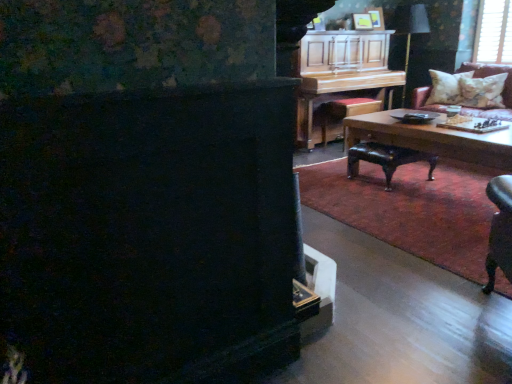
I want to click on black fabric lampshade at upper right, so click(409, 30).

Measure the distance between point (502, 83) and camera.

They are 5.14 meters apart.

The height and width of the screenshot is (384, 512). I want to click on wooden stool at center, the first stool in the top-to-bottom sequence, so click(x=346, y=111).

What is the approximate width of leather couch with floral pillows at upper right?

leather couch with floral pillows at upper right is 32.00 inches in width.

I want to click on leather couch with floral pillows at upper right, so tap(495, 109).

This screenshot has width=512, height=384. What do you see at coordinates (362, 21) in the screenshot?
I see `matte yellow picture frame at upper center` at bounding box center [362, 21].

What are the coordinates of `black fabric lampshade at upper right` in the screenshot? It's located at (409, 30).

Is wooden piano at upper right positioned beyond the bounds of leather couch with floral pillows at upper right?

Yes.

What's the angular difference between wooden piano at upper right and leather couch with floral pillows at upper right's facing directions?

wooden piano at upper right and leather couch with floral pillows at upper right are facing 89.7 degrees away from each other.

Considering the relative sizes of wooden piano at upper right and leather couch with floral pillows at upper right in the image provided, is wooden piano at upper right taller than leather couch with floral pillows at upper right?

Yes, wooden piano at upper right is taller than leather couch with floral pillows at upper right.

Is wooden piano at upper right with leather couch with floral pillows at upper right?

No, wooden piano at upper right is not with leather couch with floral pillows at upper right.

How many degrees apart are the facing directions of matte yellow picture frame at upper center and white mesh screen at upper right?

81.4 degrees separate the facing orientations of matte yellow picture frame at upper center and white mesh screen at upper right.

From the image's perspective, which one is positioned higher, matte yellow picture frame at upper center or white mesh screen at upper right?

From the image's view, matte yellow picture frame at upper center is above.

Considering the sizes of objects matte yellow picture frame at upper center and white mesh screen at upper right in the image provided, who is smaller, matte yellow picture frame at upper center or white mesh screen at upper right?

With smaller size is matte yellow picture frame at upper center.

Where is `picture frame that is above the white mesh screen at upper right (from the image's perspective)`? This screenshot has height=384, width=512. picture frame that is above the white mesh screen at upper right (from the image's perspective) is located at coordinates (362, 21).

From a real-world perspective, is wooden stool at center, marked as the 2th stool in a bottom-to-top arrangement, positioned above or below leather couch with floral pillows at upper right?

In terms of real-world spatial position, wooden stool at center, marked as the 2th stool in a bottom-to-top arrangement, is below leather couch with floral pillows at upper right.

Where is `stool that appears behind the leather couch with floral pillows at upper right`? The width and height of the screenshot is (512, 384). stool that appears behind the leather couch with floral pillows at upper right is located at coordinates (346, 111).

Considering the sizes of wooden stool at center, the 2th stool viewed from the front, and leather couch with floral pillows at upper right in the image, is wooden stool at center, the 2th stool viewed from the front, taller or shorter than leather couch with floral pillows at upper right?

Considering their sizes, wooden stool at center, the 2th stool viewed from the front, has less height than leather couch with floral pillows at upper right.

Can we say wooden stool at center, the first stool in the top-to-bottom sequence, lies outside leather couch with floral pillows at upper right?

wooden stool at center, the first stool in the top-to-bottom sequence, is positioned outside leather couch with floral pillows at upper right.

From a real-world perspective, between leather couch with floral pillows at upper right and black fabric lampshade at upper right, who is vertically higher?

From a 3D spatial view, black fabric lampshade at upper right is above.

Is leather couch with floral pillows at upper right not close to black fabric lampshade at upper right?

leather couch with floral pillows at upper right is near black fabric lampshade at upper right, not far away.

Is black fabric lampshade at upper right located within leather couch with floral pillows at upper right?

No, black fabric lampshade at upper right is located outside of leather couch with floral pillows at upper right.

From a real-world perspective, which object stands above the other?

In real-world perspective, matte yellow picture frame at upper center is above.

Is point (508, 71) less distant than point (367, 13)?

No, it is not.

From the image's perspective, which one is positioned higher, leather couch with floral pillows at upper right or matte yellow picture frame at upper center?

matte yellow picture frame at upper center appears higher in the image.

Who is shorter, leather couch with floral pillows at upper right or matte yellow picture frame at upper center?

matte yellow picture frame at upper center is shorter.

In the image, there is a fluffy beige pillow at upper right, the 2th pillow when ordered from front to back. Where is `coffee table below it (from a real-world perspective)`? This screenshot has width=512, height=384. coffee table below it (from a real-world perspective) is located at coordinates 432,138.

Between fluffy beige pillow at upper right, positioned as the 1th pillow in back-to-front order, and wooden polished coffee table at center, which one appears on the left side from the viewer's perspective?

From the viewer's perspective, wooden polished coffee table at center appears more on the left side.

Considering the points (443, 101) and (497, 168), which point is in front, point (443, 101) or point (497, 168)?

Point (497, 168)

Could you tell me if fluffy beige pillow at upper right, the 2th pillow when ordered from front to back, is turned towards wooden polished coffee table at center?

Yes, fluffy beige pillow at upper right, the 2th pillow when ordered from front to back, is turned towards wooden polished coffee table at center.

In the image, is wooden piano at upper right positioned in front of or behind white textured pillow at upper right, arranged as the second pillow when viewed from the back?

In the image, wooden piano at upper right appears in front of white textured pillow at upper right, arranged as the second pillow when viewed from the back.

Based on the photo, how different are the orientations of wooden piano at upper right and white textured pillow at upper right, which is counted as the 1th pillow, starting from the front, in degrees?

They differ by 66 degrees in their facing directions.

Which is closer, (x=345, y=48) or (x=498, y=90)?

Point (x=345, y=48) is positioned closer to the camera compared to point (x=498, y=90).

From a real-world perspective, between wooden piano at upper right and white textured pillow at upper right, which is counted as the 1th pillow, starting from the front, who is vertically higher?

wooden piano at upper right.

You are a GUI agent. You are given a task and a screenshot of the screen. Output one action in this format:
    pyautogui.click(x=<x>, y=<y>)
    Task: Click on the piano on the left of leather couch with floral pillows at upper right
    
    Given the screenshot: What is the action you would take?
    pyautogui.click(x=341, y=72)

This screenshot has width=512, height=384. Find the location of `picture frame above the white mesh screen at upper right (from a real-world perspective)`. picture frame above the white mesh screen at upper right (from a real-world perspective) is located at coordinates (362, 21).

Based on their spatial positions, is wooden piano at upper right or white textured pillow at upper right, arranged as the second pillow when viewed from the back, further from wooden stool at center, marked as the 2th stool in a bottom-to-top arrangement?

Among the two, white textured pillow at upper right, arranged as the second pillow when viewed from the back, is located further to wooden stool at center, marked as the 2th stool in a bottom-to-top arrangement.

Looking at this image, from the image, which object appears to be nearer to fluffy beige pillow at upper right, the 2th pillow when ordered from front to back, white textured pillow at upper right, which is counted as the 1th pillow, starting from the front, or black fabric lampshade at upper right?

Among the two, white textured pillow at upper right, which is counted as the 1th pillow, starting from the front, is located nearer to fluffy beige pillow at upper right, the 2th pillow when ordered from front to back.

Consider the image. When comparing their distances from black fabric lampshade at upper right, does matte yellow picture frame at upper center or wooden piano at upper right seem further?

wooden piano at upper right.

Consider the image. Looking at the image, which one is located closer to black fabric lampshade at upper right, white textured pillow at upper right, which is counted as the 1th pillow, starting from the front, or leather stool at center, which is the 1th stool from front to back?

white textured pillow at upper right, which is counted as the 1th pillow, starting from the front, is positioned closer to the anchor black fabric lampshade at upper right.

From the image, which object appears to be farther from leather couch with floral pillows at upper right, wooden stool at center, placed as the 1th stool when sorted from back to front, or wooden piano at upper right?

Based on the image, wooden stool at center, placed as the 1th stool when sorted from back to front, appears to be further to leather couch with floral pillows at upper right.

Considering their positions, is white mesh screen at upper right positioned closer to white textured pillow at upper right, which is counted as the 1th pillow, starting from the front, than fluffy beige pillow at upper right, positioned as the 1th pillow in back-to-front order?

The object closer to white textured pillow at upper right, which is counted as the 1th pillow, starting from the front, is fluffy beige pillow at upper right, positioned as the 1th pillow in back-to-front order.

From the image, which object appears to be farther from leather couch with floral pillows at upper right, wooden piano at upper right or wooden stool at center, marked as the 2th stool in a bottom-to-top arrangement?

wooden stool at center, marked as the 2th stool in a bottom-to-top arrangement, is positioned further to the anchor leather couch with floral pillows at upper right.

Considering their positions, is matte yellow picture frame at upper center positioned further to white textured pillow at upper right, which is counted as the 1th pillow, starting from the front, than fluffy beige pillow at upper right, positioned as the 1th pillow in back-to-front order?

Based on the image, matte yellow picture frame at upper center appears to be further to white textured pillow at upper right, which is counted as the 1th pillow, starting from the front.

I want to click on picture frame located between wooden piano at upper right and fluffy beige pillow at upper right, the 2th pillow when ordered from front to back, in the left-right direction, so point(362,21).

Find the location of a particular element. Image resolution: width=512 pixels, height=384 pixels. studio couch between wooden polished coffee table at center and wooden stool at center, placed as the 1th stool when sorted from back to front, in the front-back direction is located at coordinates (495, 109).

This screenshot has width=512, height=384. I want to click on window screen between matte yellow picture frame at upper center and leather stool at center, which is the 1th stool from front to back, from top to bottom, so click(494, 32).

At what (x,y) coordinates should I click in order to perform the action: click on lamp between wooden piano at upper right and fluffy beige pillow at upper right, positioned as the 1th pillow in back-to-front order. Please return your answer as a coordinate pair (x, y). The width and height of the screenshot is (512, 384). Looking at the image, I should click on (409, 30).